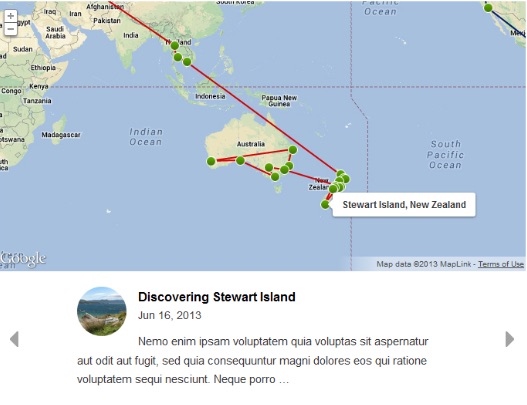
Locate an element on the screen. The height and width of the screenshot is (405, 527). map is located at coordinates (304, 72).